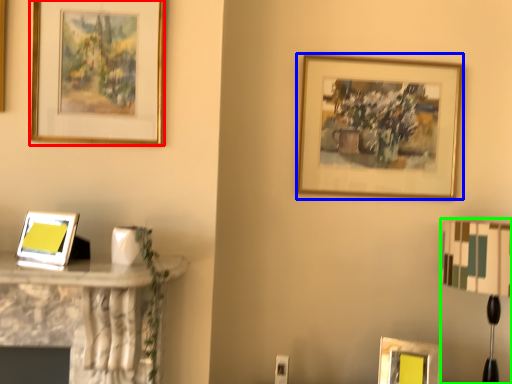
Question: Considering the real-world distances, which object is farthest from picture frame (highlighted by a red box)? picture frame (highlighted by a blue box) or table lamp (highlighted by a green box)?

Choices:
 (A) picture frame
 (B) table lamp

Answer: (B)